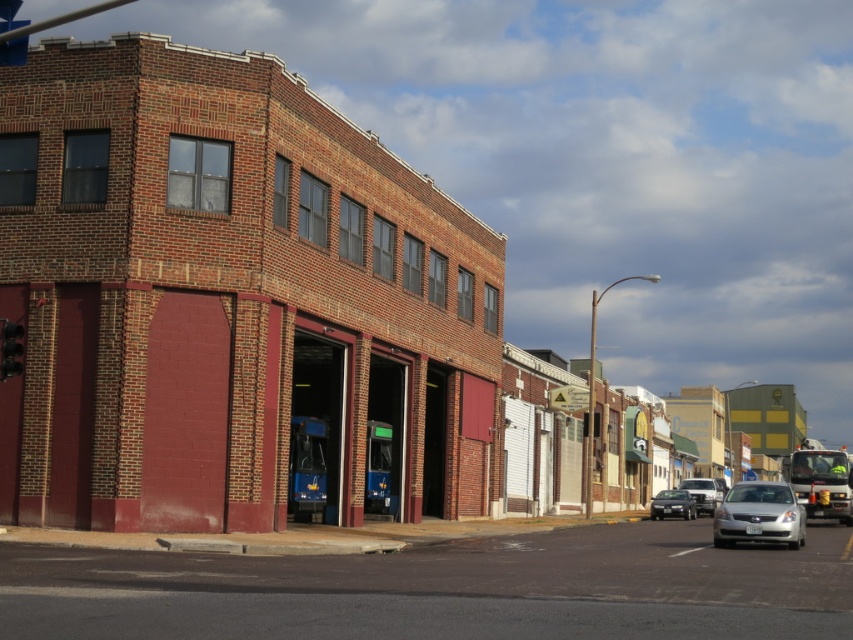
Question: Which is nearer to the silver metallic sedan at center-right?

Choices:
 (A) metallic at left
 (B) silver metallic sedan at center
 (C) satin silver sedan at center

Answer: (C)

Question: Can you confirm if metallic at left is wider than silver metallic sedan at center?

Choices:
 (A) no
 (B) yes

Answer: (A)

Question: Which point is closer to the camera?

Choices:
 (A) silver metallic sedan at center-right
 (B) silver metallic sedan at center
 (C) metallic at left

Answer: (C)

Question: Which point is closer to the camera taking this photo?

Choices:
 (A) (712, 524)
 (B) (699, 486)
 (C) (20, 353)
 (D) (653, 509)

Answer: (C)

Question: Does metallic at left appear over silver metallic sedan at center?

Choices:
 (A) yes
 (B) no

Answer: (A)

Question: Does silver metallic sedan at center-right have a larger size compared to metallic at left?

Choices:
 (A) yes
 (B) no

Answer: (A)